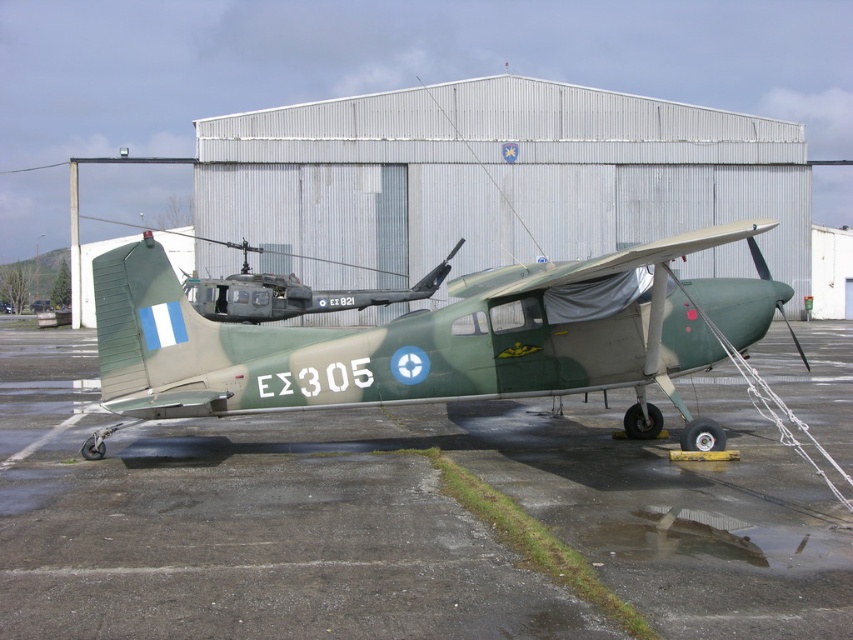
Question: Does camouflage paint airplane at center come behind matte green helicopter at center?

Choices:
 (A) yes
 (B) no

Answer: (B)

Question: Which of these objects is positioned farthest from the matte green helicopter at center?

Choices:
 (A) camouflage paint airplane at center
 (B) smooth asphalt tarmac at center

Answer: (A)

Question: Which point appears farthest from the camera in this image?

Choices:
 (A) (238, 308)
 (B) (16, 374)

Answer: (B)

Question: Which object is farther from the camera taking this photo?

Choices:
 (A) camouflage paint airplane at center
 (B) matte green helicopter at center
 (C) smooth asphalt tarmac at center

Answer: (B)

Question: Does smooth asphalt tarmac at center appear over matte green helicopter at center?

Choices:
 (A) yes
 (B) no

Answer: (B)

Question: Can you confirm if smooth asphalt tarmac at center is positioned below matte green helicopter at center?

Choices:
 (A) no
 (B) yes

Answer: (B)